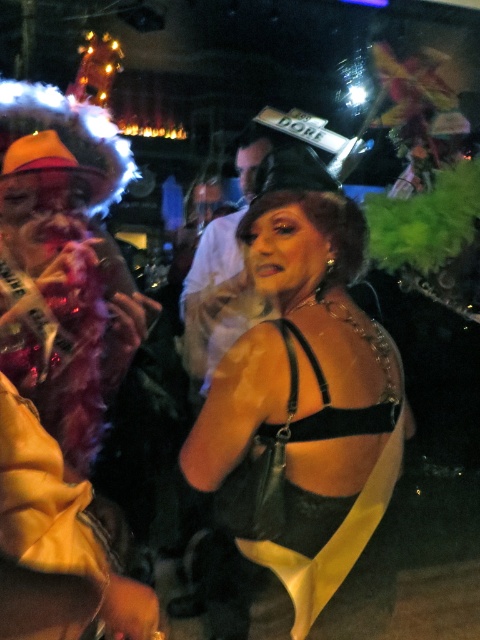
Question: Which of the following is the closest to the observer?

Choices:
 (A) (265, 147)
 (B) (338, 516)

Answer: (B)

Question: Is velvet black dress at center smaller than matte black tank top at center?

Choices:
 (A) yes
 (B) no

Answer: (A)

Question: Does velvet black dress at center appear over matte black tank top at center?

Choices:
 (A) no
 (B) yes

Answer: (A)

Question: Which point is farther to the camera?

Choices:
 (A) (182, 353)
 (B) (249, 406)

Answer: (A)

Question: Can you confirm if velvet black dress at center is smaller than matte black tank top at center?

Choices:
 (A) yes
 (B) no

Answer: (A)